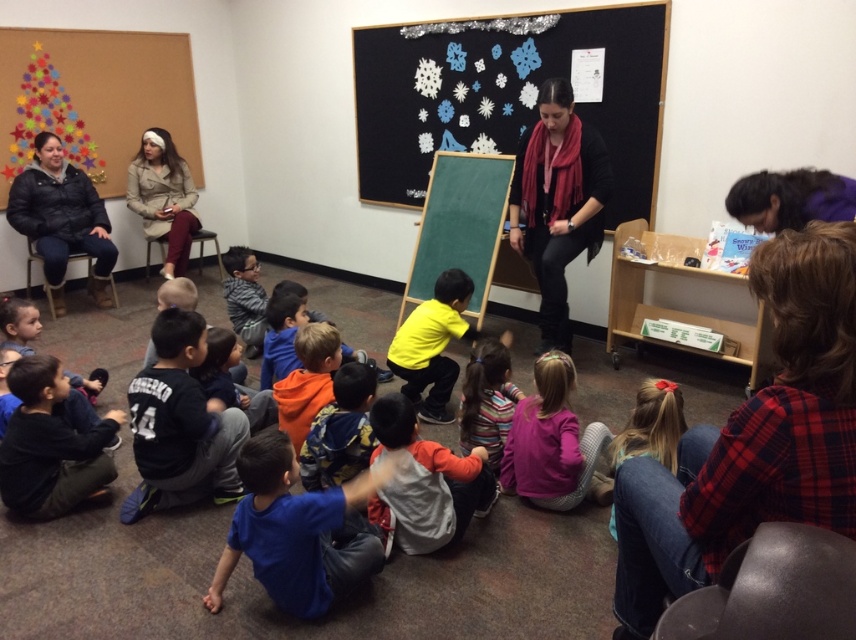
Question: Does black sweater at center appear on the left side of dark blue sweatshirt at lower left?

Choices:
 (A) no
 (B) yes

Answer: (A)

Question: Which point is closer to the camera taking this photo?

Choices:
 (A) (542, 259)
 (B) (385, 196)
 (C) (485, 406)
 (D) (266, 456)

Answer: (D)

Question: Which of the following is the closest to the observer?

Choices:
 (A) (108, 442)
 (B) (501, 349)

Answer: (A)

Question: In this image, where is blackboard with paper snowflakes at upper center located relative to striped sweater at center?

Choices:
 (A) above
 (B) below

Answer: (A)

Question: Can you confirm if blackboard with paper snowflakes at upper center is positioned above striped sweater at center?

Choices:
 (A) no
 (B) yes

Answer: (B)

Question: Which point appears farthest from the camera in this image?

Choices:
 (A) (687, 492)
 (B) (465, 273)
 (C) (455, 472)
 (D) (183, 244)

Answer: (D)